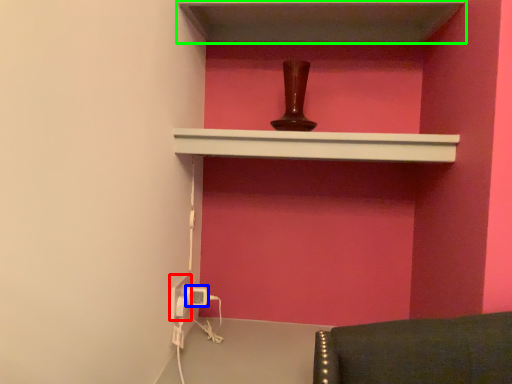
Question: Based on their relative distances, which object is farther from electric outlet (highlighted by a red box)? Choose from electric outlet (highlighted by a blue box) and shelf (highlighted by a green box).

Choices:
 (A) electric outlet
 (B) shelf

Answer: (B)